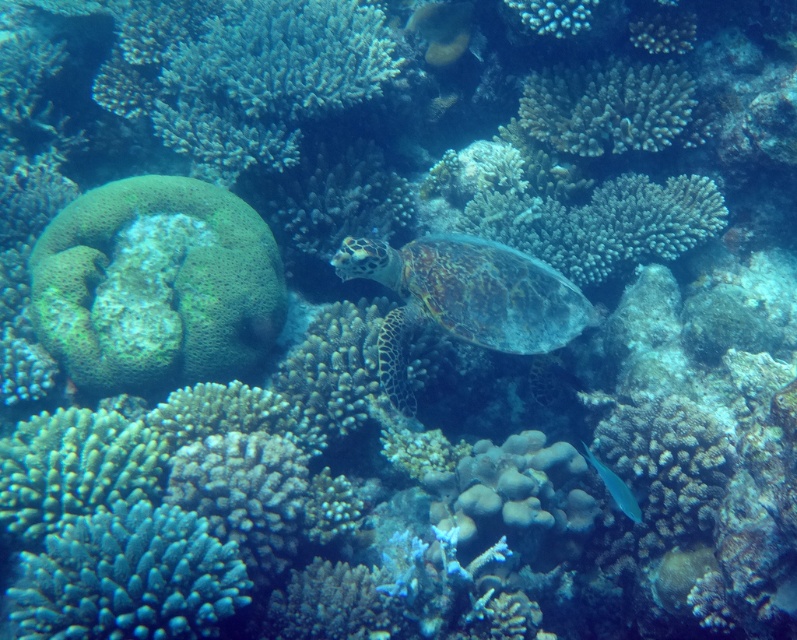
Between point (682, 106) and point (622, 508), which one is positioned behind?

Positioned behind is point (682, 106).

Can you confirm if rough textured coral at upper center is taller than blue glossy fish at lower right?

Yes, rough textured coral at upper center is taller than blue glossy fish at lower right.

This screenshot has height=640, width=797. I want to click on rough textured coral at upper center, so click(x=611, y=108).

Between greenish-brown textured shell at center and blue glossy fish at lower right, which one appears on the right side from the viewer's perspective?

blue glossy fish at lower right

Is point (542, 282) positioned after point (599, 461)?

Yes, it is behind point (599, 461).

Is point (532, 301) closer to camera compared to point (635, 522)?

No, it is behind (635, 522).

Where is `greenish-brown textured shell at center`? This screenshot has height=640, width=797. greenish-brown textured shell at center is located at coordinates click(x=466, y=301).

In the scene shown: Does greenish-brown textured shell at center have a lesser height compared to rough textured coral at upper center?

No, greenish-brown textured shell at center is not shorter than rough textured coral at upper center.

Which of these two, greenish-brown textured shell at center or rough textured coral at upper center, stands taller?

greenish-brown textured shell at center is taller.

Between point (563, 339) and point (701, 132), which one is positioned behind?

The point (701, 132) is more distant.

At what (x,y) coordinates should I click in order to perform the action: click on greenish-brown textured shell at center. Please return your answer as a coordinate pair (x, y). The image size is (797, 640). Looking at the image, I should click on (466, 301).